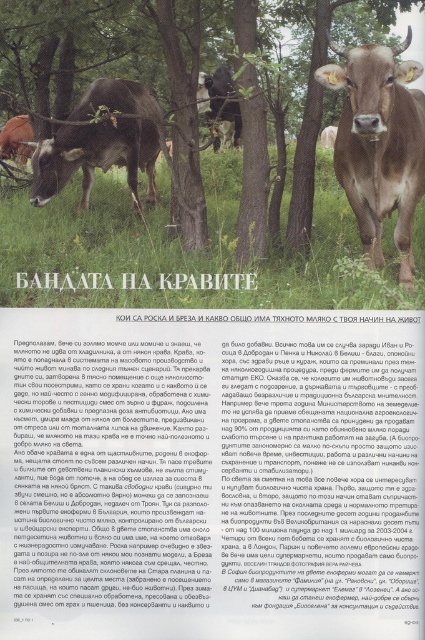
You are a photographer editing an image of cows in a field. You want to place a text box at the exact center of the image. Will the text box overlap with the brown glossy bull at center?

The brown glossy bull at center is located at point (379,144), which is not the exact center of the image. Therefore, placing a text box at the exact center will not overlap with the brown glossy bull at center.

You are a photographer who wants to capture a clear shot of the brown glossy bull at center and the whitetextured papersign at center. Which object should you focus on first if you want to ensure both are in focus?

The brown glossy bull at center is located above the whitetextured papersign at center. Since they are at different distances, focusing on the bull first would help ensure both are in focus as it is closer to the camera.